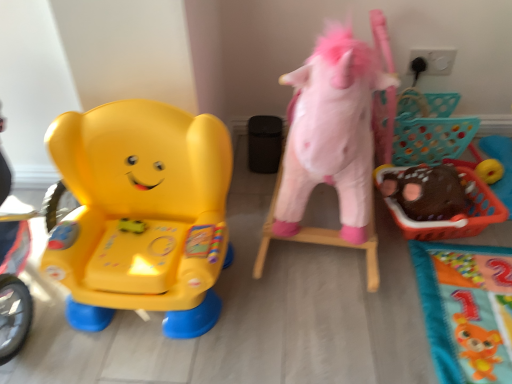
Image resolution: width=512 pixels, height=384 pixels. Identify the location of vacant area that lies in front of brown fuzzy plush at right, which appears as the first toy when viewed from the right. (455, 275).